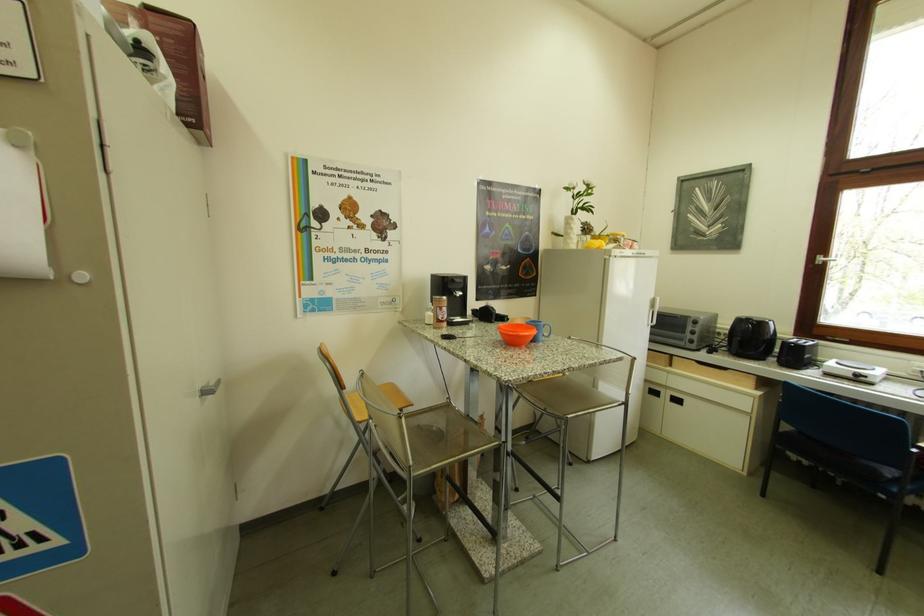
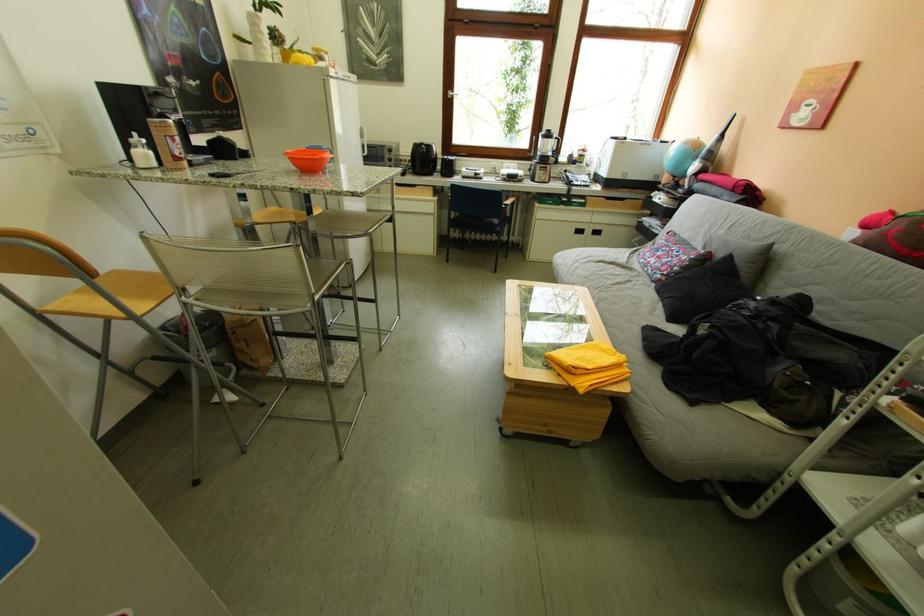
Locate, in the second image, the point that corresponds to (355,392) in the first image.

(106, 280)